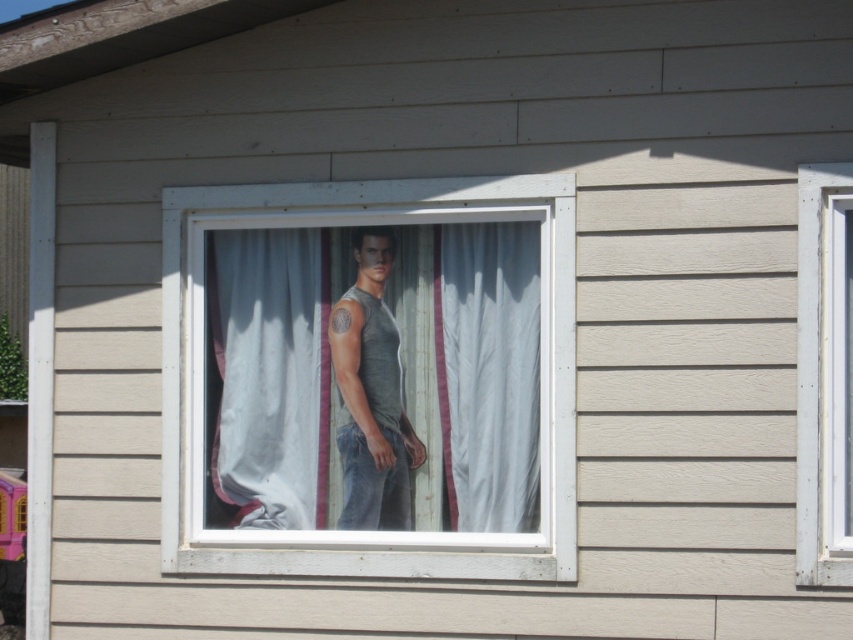
Question: Which of the following is the closest to the observer?

Choices:
 (A) white wood frame at right
 (B) gray matte tank top at center
 (C) white sheer fabric at center
 (D) matte gray tank top at center

Answer: (A)

Question: In this image, where is white sheer fabric at center located relative to white wood frame at right?

Choices:
 (A) above
 (B) below

Answer: (B)

Question: From the image, what is the correct spatial relationship of white sheer fabric at center in relation to white sheer curtain at center?

Choices:
 (A) right
 (B) left

Answer: (B)

Question: Which point is closer to the camera taking this photo?

Choices:
 (A) (843, 323)
 (B) (352, 486)

Answer: (A)

Question: Which of these objects is positioned closest to the white sheer fabric at center?

Choices:
 (A) gray matte tank top at center
 (B) matte gray tank top at center

Answer: (A)

Question: Is matte gray tank top at center smaller than gray matte tank top at center?

Choices:
 (A) yes
 (B) no

Answer: (B)